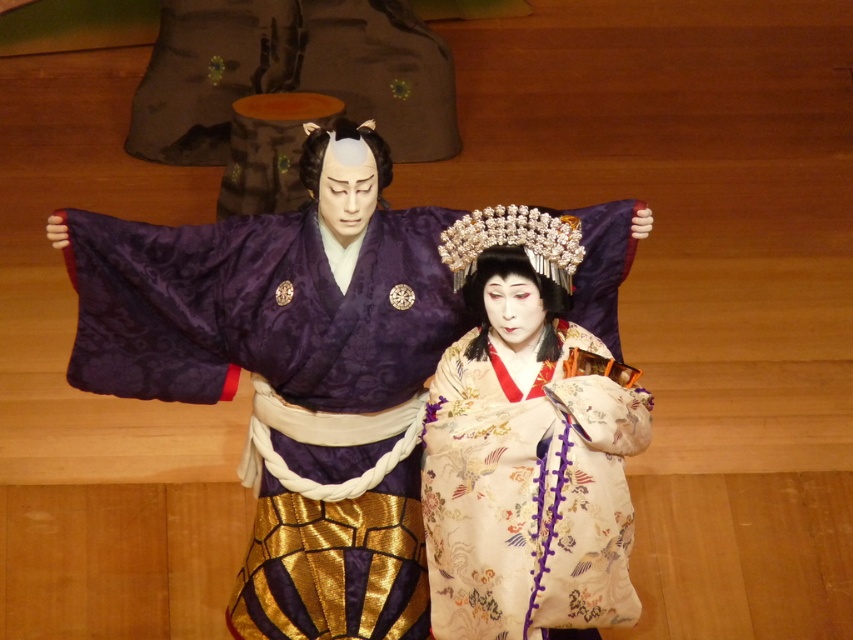
You are a photographer positioned at the center of the scene. You want to take a photo that includes both the point at [363,356] and the point at [579,636]. However, you notice that one of the points is partially obscured by another object in the scene. Which point is more likely to be visible in the photo?

Point [579,636] is more likely to be visible because it is in front of point [363,356], which is behind it and might be obscured.

Consider the image. You are a costume designer preparing for a traditional Japanese performance. You need to decide which kimono to place on the left side of the stage so that it appears more prominent. Based on the image, which kimono should you choose between the silky purple kimono at center and the silky beige kimono at center?

The silky purple kimono at center is shorter than the silky beige kimono at center. To make the kimono on the left appear more prominent, you should choose the shorter silky purple kimono at center because shorter garments can draw attention upwards and create a focal point.

You are a photographer standing at a certain distance from the silky purple kimono at center. You want to capture a closeup shot of it. Given that your camera has a maximum zoom range of 30 feet, can you get a clear closeup without moving closer?

The silky purple kimono at center is 40.79 feet away from the camera. Since the maximum zoom range is 30 feet, the camera cannot capture a clear closeup without moving closer.